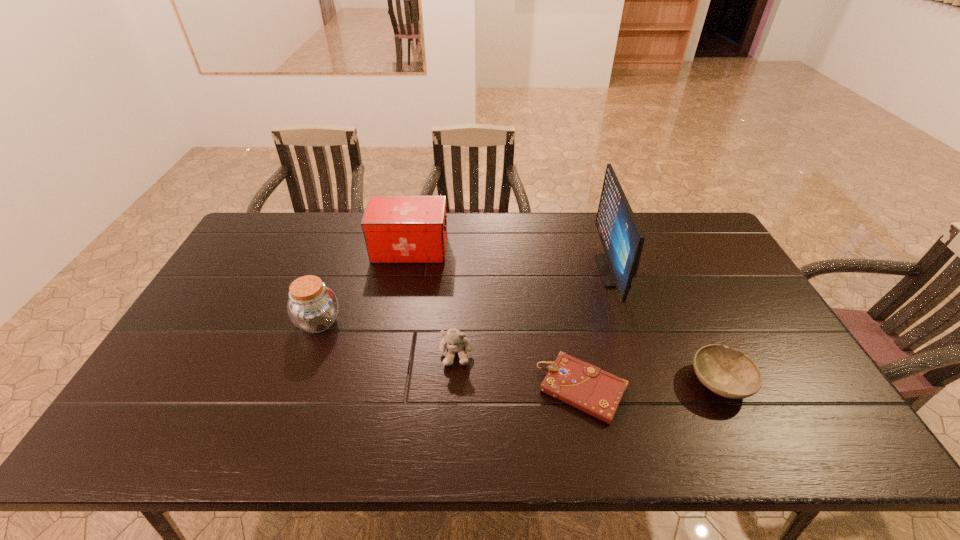
Identify the location of vacant area situated 0.070m on the screen side of the computer monitor. The image size is (960, 540). (578, 271).

Locate an element on the screen. The height and width of the screenshot is (540, 960). vacant space situated on the screen side of the computer monitor is located at coordinates (554, 271).

You are a GUI agent. You are given a task and a screenshot of the screen. Output one action in this format:
    pyautogui.click(x=<x>, y=<y>)
    Task: Click on the free space located 0.270m on the screen side of the computer monitor
    The width and height of the screenshot is (960, 540).
    Given the screenshot: What is the action you would take?
    pyautogui.click(x=516, y=271)

Find the location of a particular element. blank area located 0.150m on the handle side of the second object from left to right is located at coordinates (492, 249).

This screenshot has height=540, width=960. What are the coordinates of `free space located 0.210m on the front of the leftmost object` in the screenshot? It's located at (287, 408).

Find the location of a particular element. free region located on the face of the teddy bear is located at coordinates (451, 438).

At what (x,y) coordinates should I click in order to perform the action: click on free space located 0.060m on the front of the bowl. Please return your answer as a coordinate pair (x, y). The image size is (960, 540). Looking at the image, I should click on (744, 433).

You are a GUI agent. You are given a task and a screenshot of the screen. Output one action in this format:
    pyautogui.click(x=<x>, y=<y>)
    Task: Click on the vacant space located on the right of the shortest object
    The height and width of the screenshot is (540, 960).
    Given the screenshot: What is the action you would take?
    pyautogui.click(x=712, y=389)

This screenshot has width=960, height=540. I want to click on computer monitor located at the far edge, so click(x=621, y=236).

Locate an element on the screen. the first-aid kit at the far edge is located at coordinates (397, 229).